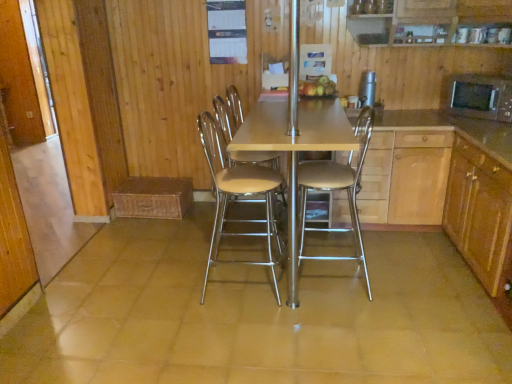
Where is `free space in front of metallic beige stool at center, arranged as the second chair when viewed from the left`? The image size is (512, 384). free space in front of metallic beige stool at center, arranged as the second chair when viewed from the left is located at coordinates (335, 324).